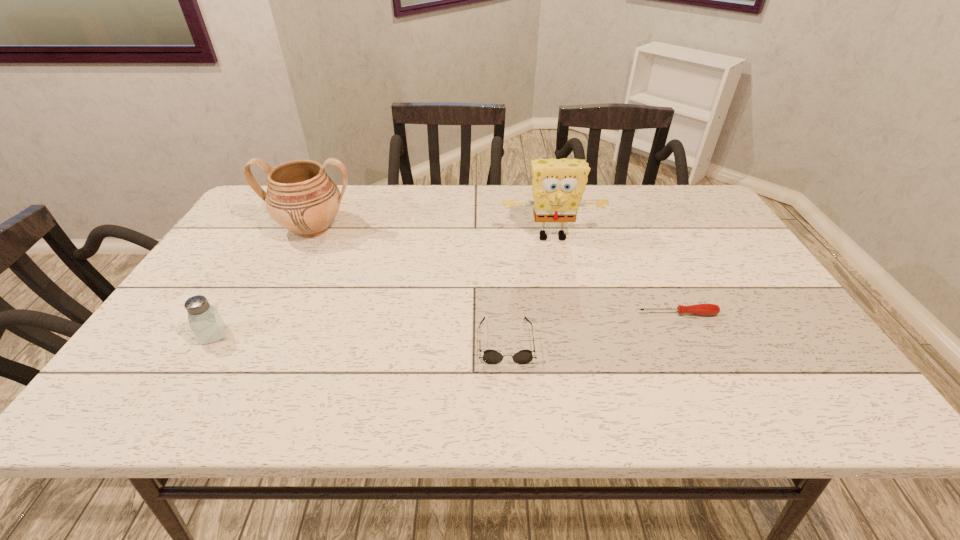
At what (x,y) coordinates should I click in order to perform the action: click on vacant space located 0.110m on the left of the shortest object. Please return your answer as a coordinate pair (x, y). The image size is (960, 540). Looking at the image, I should click on (591, 314).

Where is `object present at the far edge`? The width and height of the screenshot is (960, 540). object present at the far edge is located at coordinates (301, 197).

Identify the location of urn present at the left edge. click(301, 197).

Where is `saltshaker present at the left edge`? The image size is (960, 540). saltshaker present at the left edge is located at coordinates (208, 326).

Find the location of a particular element. object that is at the far left corner is located at coordinates coord(301,197).

Image resolution: width=960 pixels, height=540 pixels. In order to click on vacant space at the far edge in this screenshot , I will do `click(585, 198)`.

In the image, there is a desktop. Find the location of `vacant space at the near edge`. vacant space at the near edge is located at coordinates (589, 387).

The width and height of the screenshot is (960, 540). I want to click on free space at the left edge, so click(252, 285).

The width and height of the screenshot is (960, 540). In the image, there is a desktop. In order to click on vacant space at the right edge in this screenshot , I will do `click(760, 376)`.

Locate an element on the screen. Image resolution: width=960 pixels, height=540 pixels. blank area at the near left corner is located at coordinates (190, 380).